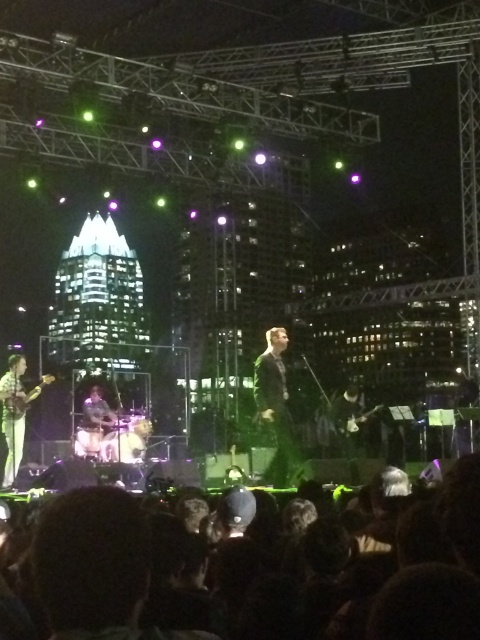
Does dark hair at lower center appear over shiny silver guitar at left?

Actually, dark hair at lower center is below shiny silver guitar at left.

Does dark hair at lower center have a larger size compared to shiny silver guitar at left?

Yes.

Is point (86, 618) positioned before point (44, 381)?

Yes.

Where is `dark hair at lower center`? The image size is (480, 640). dark hair at lower center is located at coordinates click(96, 566).